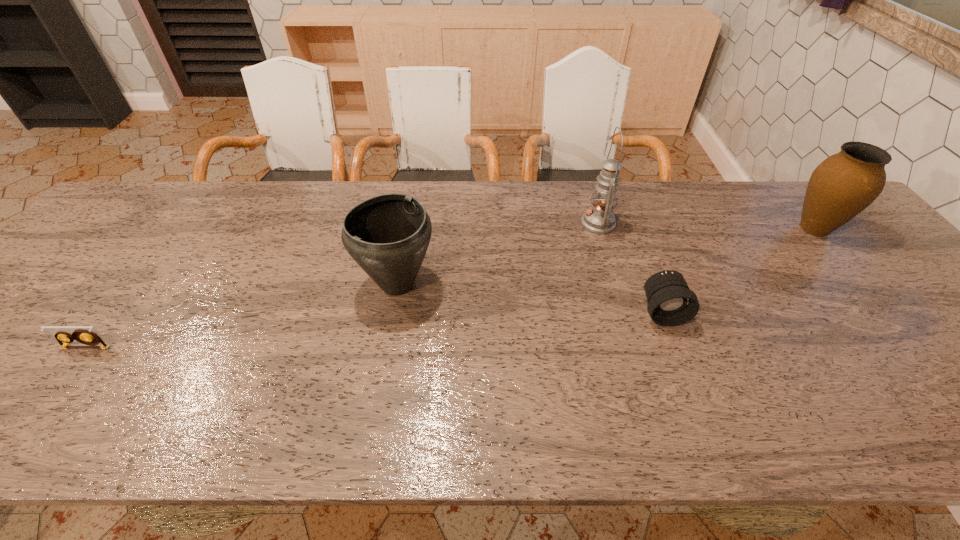
Locate an element on the screen. This screenshot has height=540, width=960. oil lamp is located at coordinates (599, 219).

At what (x,y) coordinates should I click in order to perform the action: click on the rightmost object. Please return your answer as a coordinate pair (x, y). The image size is (960, 540). Looking at the image, I should click on (843, 185).

Identify the location of the farther urn. The width and height of the screenshot is (960, 540). (843, 185).

Identify the location of the fourth object from right to left. (388, 235).

In order to click on the left urn in this screenshot , I will do `click(388, 235)`.

Identify the location of the fourth tallest object. The height and width of the screenshot is (540, 960). (670, 301).

You are a GUI agent. You are given a task and a screenshot of the screen. Output one action in this format:
    pyautogui.click(x=<x>, y=<y>)
    Task: Click on the nearest object
    This screenshot has width=960, height=540.
    Given the screenshot: What is the action you would take?
    pyautogui.click(x=82, y=335)

In order to click on the shortest object in this screenshot , I will do `click(82, 335)`.

This screenshot has height=540, width=960. Identify the location of vacant space located 0.060m on the left of the oil lamp. (561, 223).

The image size is (960, 540). Identify the location of free space located 0.100m on the left of the farther urn. (753, 229).